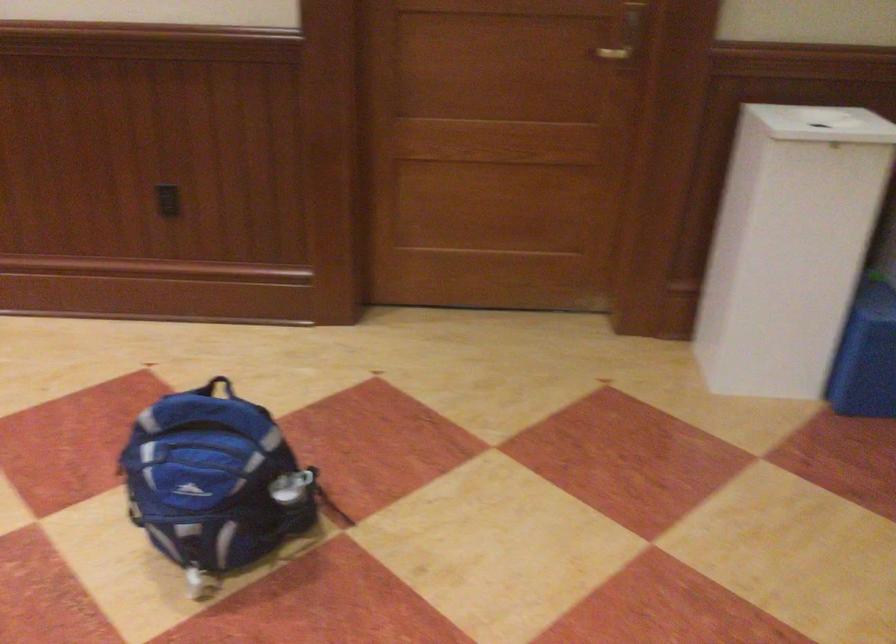
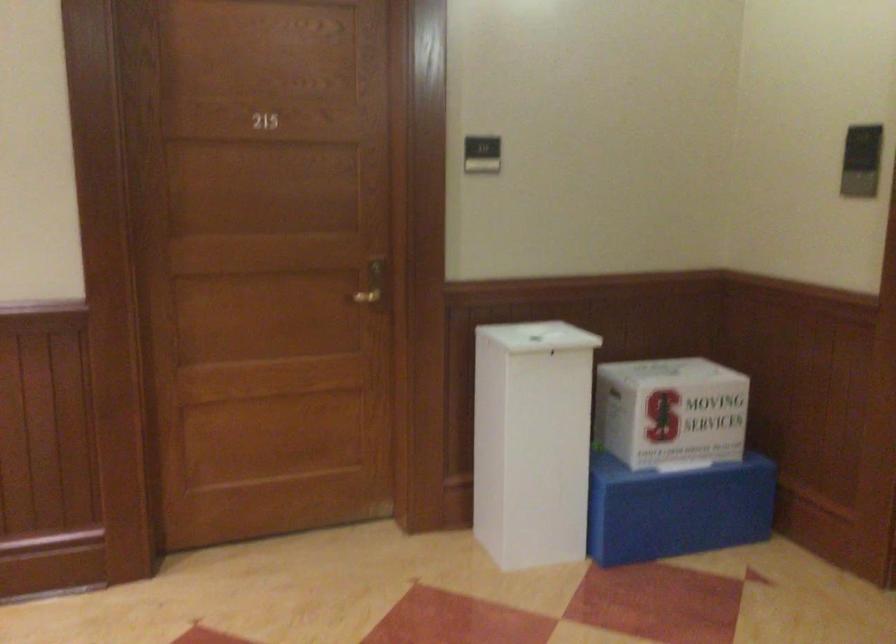
Question: How did the camera likely rotate?

Choices:
 (A) Left
 (B) Right
 (C) Up
 (D) Down

Answer: (B)